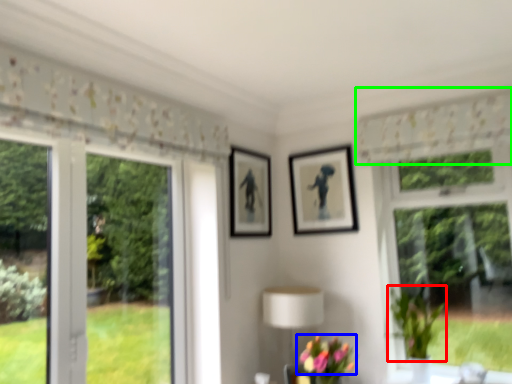
Question: Based on their relative distances, which object is farther from plant (highlighted by a red box)? Choose from flower (highlighted by a blue box) and curtain (highlighted by a green box).

Choices:
 (A) flower
 (B) curtain

Answer: (B)